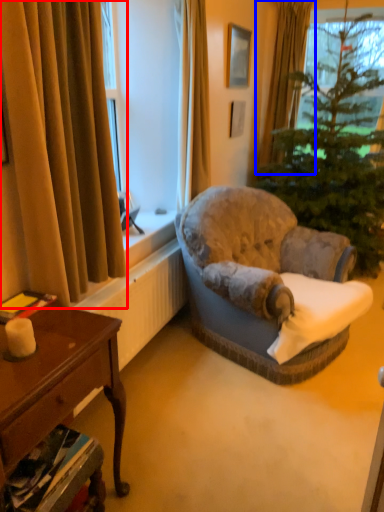
Question: Which object appears closest to the camera in this image, curtain (highlighted by a red box) or curtain (highlighted by a blue box)?

Choices:
 (A) curtain
 (B) curtain

Answer: (A)